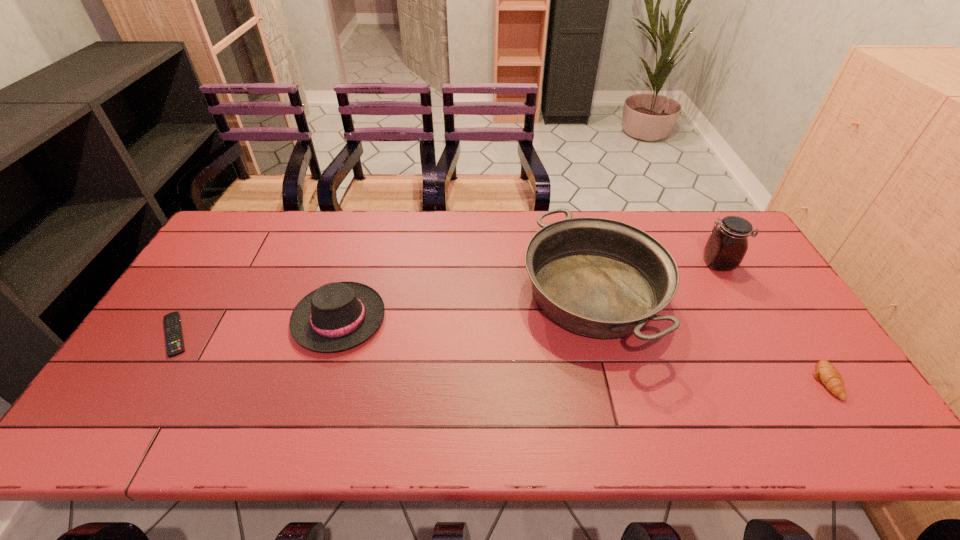
This screenshot has height=540, width=960. I want to click on vacant area situated on the lid of the jar, so click(618, 264).

Identify the location of free region located on the lid of the jar. The image size is (960, 540). (675, 264).

At what (x,y) coordinates should I click in order to perform the action: click on free space located 0.120m on the front of the third object from left to right. Please return your answer as a coordinate pair (x, y). Image resolution: width=960 pixels, height=540 pixels. Looking at the image, I should click on (622, 414).

This screenshot has height=540, width=960. Identify the location of vacant point located on the right of the fourth object from right to left. (403, 319).

The image size is (960, 540). I want to click on vacant space situated 0.290m on the left of the crescent roll, so click(696, 381).

The image size is (960, 540). Find the location of `vacant region located 0.150m on the front of the remote control`. vacant region located 0.150m on the front of the remote control is located at coordinates (127, 411).

The height and width of the screenshot is (540, 960). I want to click on jar at the far edge, so point(727,245).

The height and width of the screenshot is (540, 960). Find the location of `pan that is positioned at the far edge`. pan that is positioned at the far edge is located at coordinates (597, 277).

Where is `object at the left edge`? object at the left edge is located at coordinates (172, 322).

Identify the location of jar that is at the right edge. Image resolution: width=960 pixels, height=540 pixels. (727, 245).